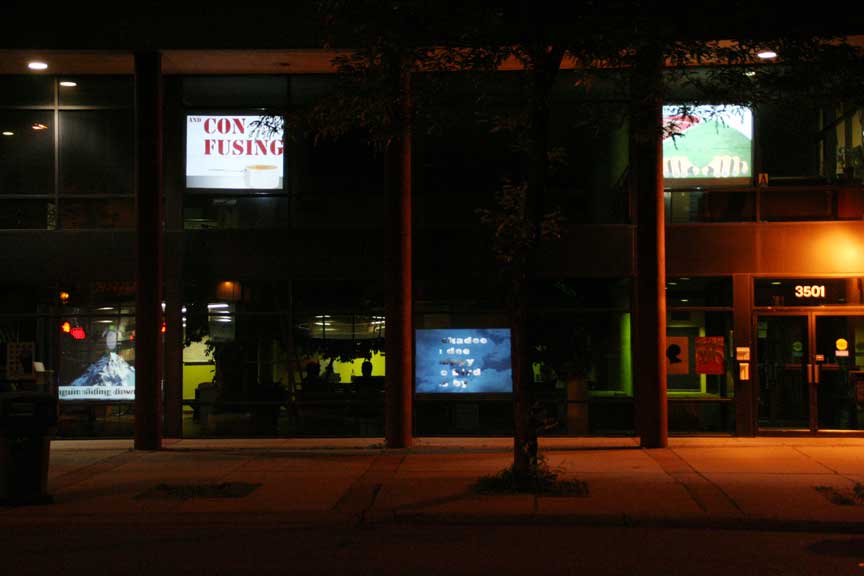
At what (x,y) coordinates should I click in order to perform the action: click on entrance way. Please return your answer as a coordinate pair (x, y). This screenshot has height=576, width=864. Looking at the image, I should click on (812, 386).